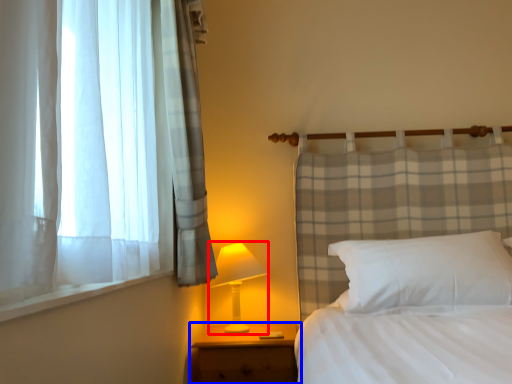
Question: Which of the following is the farthest to the observer, table lamp (highlighted by a red box) or nightstand (highlighted by a blue box)?

Choices:
 (A) table lamp
 (B) nightstand

Answer: (A)